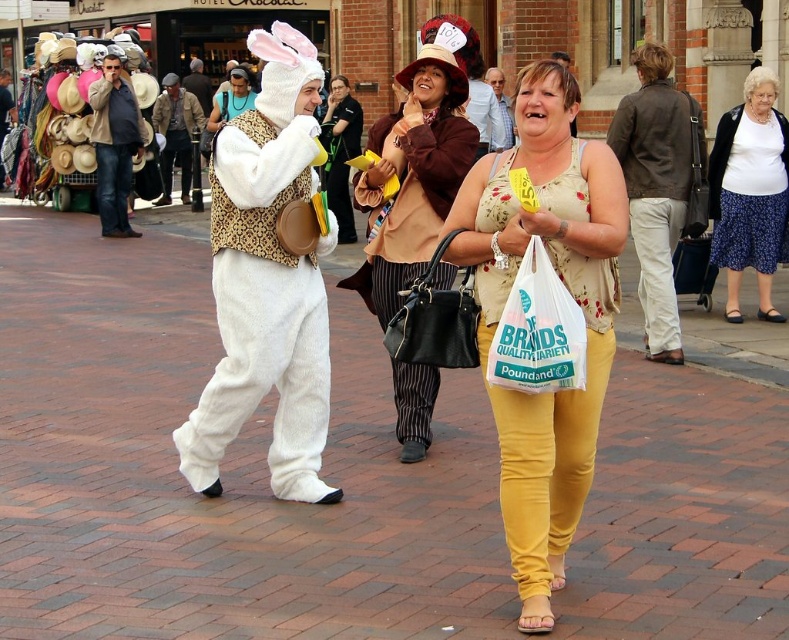
Does point (88, 269) come farther from viewer compared to point (350, 115)?

No, it is not.

Is brick pavement at center to the right of matte brown purse at center from the viewer's perspective?

Correct, you'll find brick pavement at center to the right of matte brown purse at center.

Which is in front, point (144, 464) or point (338, 189)?

Positioned in front is point (144, 464).

I want to click on brick pavement at center, so click(x=221, y=470).

Is denim jacket at upper left further to camera compared to white plush costume at center?

That is False.

Looking at this image, which is below, denim jacket at upper left or white plush costume at center?

denim jacket at upper left is lower down.

Is point (114, 122) more distant than point (196, 86)?

That is False.

Where is `denim jacket at upper left`? This screenshot has height=640, width=789. denim jacket at upper left is located at coordinates (114, 145).

How distant is white plastic bag at center from white plush costume at center?

A distance of 20.53 meters exists between white plastic bag at center and white plush costume at center.

Who is more forward, (537, 301) or (206, 86)?

Point (537, 301)

Is point (578, 349) farther from viewer compared to point (187, 81)?

No, it is in front of (187, 81).

Where is `white plastic bag at center`? Image resolution: width=789 pixels, height=640 pixels. white plastic bag at center is located at coordinates (537, 332).